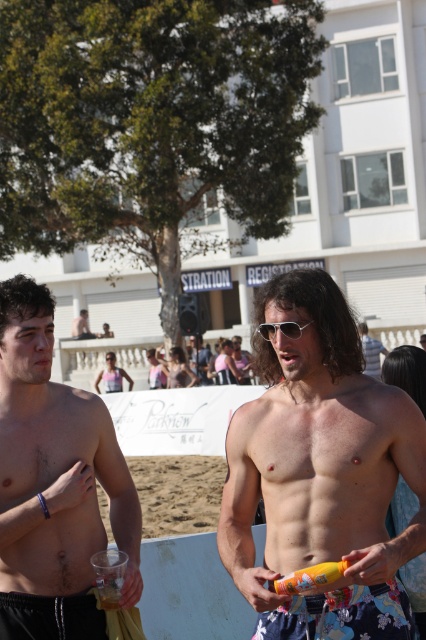
Which is above, smooth tan skin at center or yellow matte can at center?

smooth tan skin at center

Who is positioned more to the left, smooth tan skin at center or yellow matte can at center?

From the viewer's perspective, yellow matte can at center appears more on the left side.

Which is in front, point (268, 522) or point (319, 586)?

Point (319, 586) is in front.

The image size is (426, 640). What are the coordinates of `smooth tan skin at center` in the screenshot? It's located at (321, 472).

Is black matte shorts at lower left bigger than smooth skin man at center?

No, black matte shorts at lower left is not bigger than smooth skin man at center.

Does black matte shorts at lower left have a lesser height compared to smooth skin man at center?

Yes, black matte shorts at lower left is shorter than smooth skin man at center.

Which is behind, point (25, 614) or point (85, 308)?

The point (85, 308) is more distant.

The height and width of the screenshot is (640, 426). In order to click on black matte shorts at lower left in this screenshot , I will do `click(49, 616)`.

Consider the image. Is smooth tan skin at center bigger than floral fabric shorts at lower center?

Correct, smooth tan skin at center is larger in size than floral fabric shorts at lower center.

Does smooth tan skin at center appear on the left side of floral fabric shorts at lower center?

Correct, you'll find smooth tan skin at center to the left of floral fabric shorts at lower center.

This screenshot has height=640, width=426. What are the coordinates of `smooth tan skin at center` in the screenshot? It's located at (321, 472).